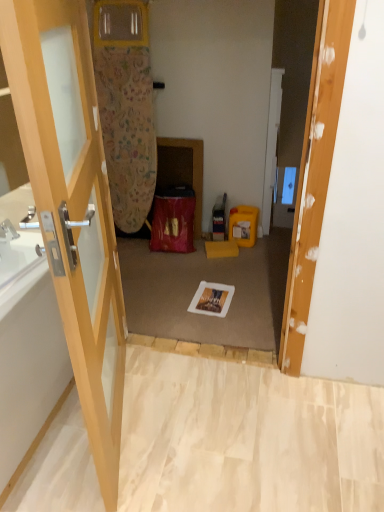
Describe the element at coordinates (243, 225) in the screenshot. This screenshot has height=512, width=384. I see `yellow plastic box at center-right` at that location.

The width and height of the screenshot is (384, 512). What do you see at coordinates (29, 368) in the screenshot?
I see `white glossy bathtub at left` at bounding box center [29, 368].

This screenshot has height=512, width=384. What do you see at coordinates (72, 205) in the screenshot?
I see `wooden door at center, which ranks as the second door in right-to-left order` at bounding box center [72, 205].

You are a GUI agent. You are given a task and a screenshot of the screen. Output one action in this format:
    pyautogui.click(x=<x>, y=<y>)
    Task: Click on the wooden door at center, which ranks as the 1th door in left-to-right order
    The width and height of the screenshot is (384, 512).
    Given the screenshot: What is the action you would take?
    click(72, 205)

The image size is (384, 512). I want to click on yellow plastic box at center-right, so click(243, 225).

Can you tell me how much yellow plastic box at center-right and white glossy door at center, the second door in the left-to-right sequence, differ in facing direction?

They differ by 92.5 degrees in their facing directions.

Is the position of yellow plastic box at center-right less distant than that of white glossy door at center, which is the 1th door from right to left?

No, yellow plastic box at center-right is further to the viewer.

Is point (238, 210) in front of point (279, 80)?

Yes, it is in front of point (279, 80).

Could you measure the distance between yellow plastic box at center-right and white glossy door at center, the second door in the left-to-right sequence?

The distance of yellow plastic box at center-right from white glossy door at center, the second door in the left-to-right sequence, is 8.90 inches.

Based on the photo, which of these two, white glossy door at center, the second door in the left-to-right sequence, or wooden door at center, which ranks as the second door in right-to-left order, is wider?

wooden door at center, which ranks as the second door in right-to-left order.

Can you confirm if white glossy door at center, positioned as the 2th door in front-to-back order, is smaller than wooden door at center, which ranks as the 1th door in left-to-right order?

Yes.

Could you measure the distance between white glossy door at center, which is the 1th door from right to left, and wooden door at center, which ranks as the 1th door in left-to-right order?

white glossy door at center, which is the 1th door from right to left, is 1.72 meters from wooden door at center, which ranks as the 1th door in left-to-right order.

Is the depth of white glossy door at center, the second door in the left-to-right sequence, greater than that of wooden door at center, positioned as the first door in front-to-back order?

Yes, it is behind wooden door at center, positioned as the first door in front-to-back order.

From the image's perspective, is white glossy door at center, positioned as the 2th door in front-to-back order, located above or below white glossy bathtub at left?

white glossy door at center, positioned as the 2th door in front-to-back order, is above white glossy bathtub at left.

Who is shorter, white glossy door at center, which is the 1th door from right to left, or white glossy bathtub at left?

Standing shorter between the two is white glossy bathtub at left.

Is white glossy door at center, the second door in the left-to-right sequence, not close to white glossy bathtub at left?

Yes.

Does point (264, 207) come closer to viewer compared to point (55, 372)?

No.

Is wooden door at center, the second door from the back, thinner than yellow plastic box at center-right?

Indeed, wooden door at center, the second door from the back, has a lesser width compared to yellow plastic box at center-right.

Which is more to the left, wooden door at center, which ranks as the 1th door in left-to-right order, or yellow plastic box at center-right?

wooden door at center, which ranks as the 1th door in left-to-right order, is more to the left.

The image size is (384, 512). Find the location of `box behind the wooden door at center, positioned as the first door in front-to-back order`. box behind the wooden door at center, positioned as the first door in front-to-back order is located at coordinates (243, 225).

Looking at this image, does white glossy bathtub at left have a lesser width compared to white glossy door at center, which is the 1th door from right to left?

No, white glossy bathtub at left is not thinner than white glossy door at center, which is the 1th door from right to left.

From the picture: From a real-world perspective, is white glossy bathtub at left physically located above or below white glossy door at center, acting as the 1th door starting from the back?

Clearly, from a real-world perspective, white glossy bathtub at left is below white glossy door at center, acting as the 1th door starting from the back.

Which is more to the left, white glossy bathtub at left or white glossy door at center, the second door in the left-to-right sequence?

Positioned to the left is white glossy bathtub at left.

I want to click on door that is the 1st one above the white glossy bathtub at left (from a real-world perspective), so click(271, 145).

Are wooden door at center, which ranks as the 1th door in left-to-right order, and white glossy door at center, positioned as the 2th door in front-to-back order, making contact?

No.

Is wooden door at center, which ranks as the second door in right-to-left order, looking in the opposite direction of white glossy door at center, the second door in the left-to-right sequence?

wooden door at center, which ranks as the second door in right-to-left order, does not have its back to white glossy door at center, the second door in the left-to-right sequence.

The image size is (384, 512). In the image, there is a white glossy door at center, positioned as the 2th door in front-to-back order. Find the location of `door below it (from the image's perspective)`. door below it (from the image's perspective) is located at coordinates (72, 205).

Would you say wooden door at center, which ranks as the 1th door in left-to-right order, is to the left or to the right of white glossy bathtub at left in the picture?

In the image, wooden door at center, which ranks as the 1th door in left-to-right order, appears on the right side of white glossy bathtub at left.

Is wooden door at center, positioned as the first door in front-to-back order, facing away from white glossy bathtub at left?

Yes, white glossy bathtub at left is at the back of wooden door at center, positioned as the first door in front-to-back order.

Considering the relative sizes of wooden door at center, which ranks as the 1th door in left-to-right order, and white glossy bathtub at left in the image provided, is wooden door at center, which ranks as the 1th door in left-to-right order, smaller than white glossy bathtub at left?

Correct, wooden door at center, which ranks as the 1th door in left-to-right order, occupies less space than white glossy bathtub at left.

This screenshot has height=512, width=384. I want to click on box on the left of white glossy door at center, positioned as the 2th door in front-to-back order, so click(x=243, y=225).

Locate an element on the screen. The height and width of the screenshot is (512, 384). door above the white glossy door at center, positioned as the 2th door in front-to-back order (from a real-world perspective) is located at coordinates (72, 205).

Looking at the image, which one is located closer to white glossy door at center, positioned as the 2th door in front-to-back order, white glossy bathtub at left or wooden door at center, which ranks as the second door in right-to-left order?

wooden door at center, which ranks as the second door in right-to-left order, lies closer to white glossy door at center, positioned as the 2th door in front-to-back order, than the other object.

Based on their spatial positions, is wooden door at center, positioned as the first door in front-to-back order, or white glossy bathtub at left further from yellow plastic box at center-right?

white glossy bathtub at left is positioned further to the anchor yellow plastic box at center-right.

Considering their positions, is wooden door at center, positioned as the first door in front-to-back order, positioned closer to yellow plastic box at center-right than white glossy door at center, acting as the 1th door starting from the back?

white glossy door at center, acting as the 1th door starting from the back.

Estimate the real-world distances between objects in this image. Which object is further from wooden door at center, which ranks as the second door in right-to-left order, white glossy door at center, positioned as the 2th door in front-to-back order, or white glossy bathtub at left?

Among the two, white glossy door at center, positioned as the 2th door in front-to-back order, is located further to wooden door at center, which ranks as the second door in right-to-left order.

Based on their spatial positions, is yellow plastic box at center-right or wooden door at center, the second door from the back, closer to white glossy door at center, acting as the 1th door starting from the back?

yellow plastic box at center-right is positioned closer to the anchor white glossy door at center, acting as the 1th door starting from the back.

Looking at the image, which one is located further to white glossy bathtub at left, white glossy door at center, which is the 1th door from right to left, or yellow plastic box at center-right?

The object further to white glossy bathtub at left is white glossy door at center, which is the 1th door from right to left.

From the image, which object appears to be nearer to yellow plastic box at center-right, white glossy door at center, the second door in the left-to-right sequence, or white glossy bathtub at left?

white glossy door at center, the second door in the left-to-right sequence, lies closer to yellow plastic box at center-right than the other object.

Based on the photo, estimate the real-world distances between objects in this image. Which object is closer to yellow plastic box at center-right, white glossy bathtub at left or white glossy door at center, which is the 1th door from right to left?

white glossy door at center, which is the 1th door from right to left.

I want to click on bathtub located between wooden door at center, the second door from the back, and white glossy door at center, acting as the 1th door starting from the back, in the depth direction, so click(29, 368).

Find the location of a particular element. Image resolution: width=384 pixels, height=512 pixels. door between wooden door at center, which ranks as the 1th door in left-to-right order, and yellow plastic box at center-right from front to back is located at coordinates (271, 145).

Locate an element on the screen. The image size is (384, 512). door between white glossy bathtub at left and yellow plastic box at center-right along the z-axis is located at coordinates (271, 145).

Find the location of a particular element. bathtub located between wooden door at center, the second door from the back, and yellow plastic box at center-right in the depth direction is located at coordinates (29, 368).